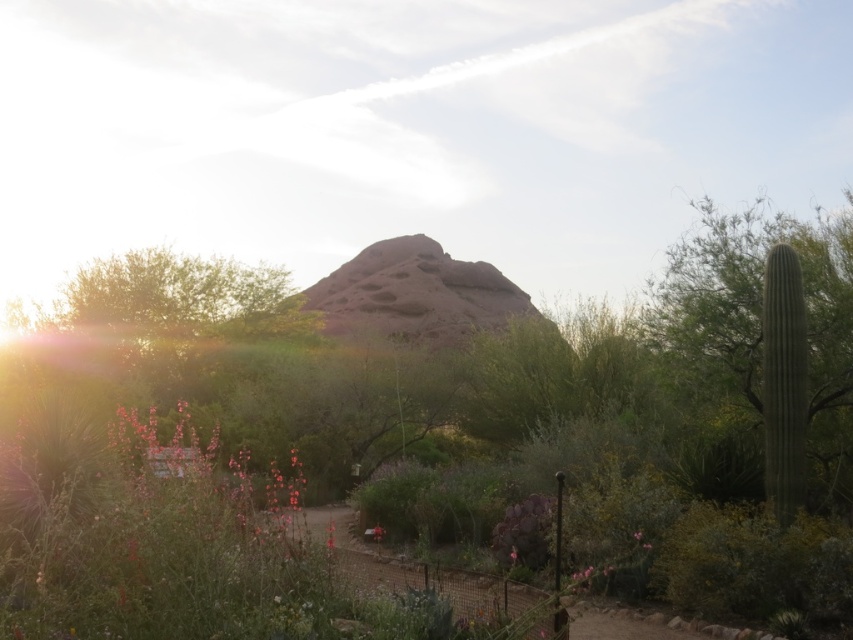
Question: Which object is positioned farthest from the green leafy bush at center?

Choices:
 (A) rustic rock formation at center
 (B) green matte flower at center

Answer: (B)

Question: Can you confirm if rustic rock formation at center is smaller than green matte flower at center?

Choices:
 (A) yes
 (B) no

Answer: (B)

Question: Does green leafy bush at center have a larger size compared to rustic rock formation at center?

Choices:
 (A) no
 (B) yes

Answer: (B)

Question: From the image, what is the correct spatial relationship of green leafy bush at center in relation to green matte flower at center?

Choices:
 (A) left
 (B) right

Answer: (A)

Question: Which is farther from the green leafy bush at center?

Choices:
 (A) green matte flower at center
 (B) rustic rock formation at center

Answer: (A)

Question: Which object is farther from the camera taking this photo?

Choices:
 (A) rustic rock formation at center
 (B) green matte flower at center
 (C) green leafy bush at center

Answer: (A)